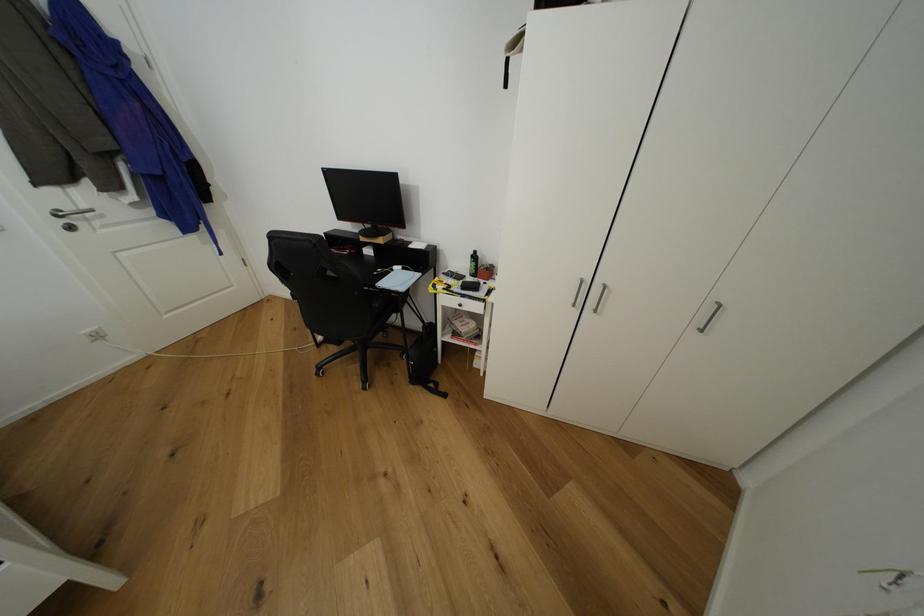
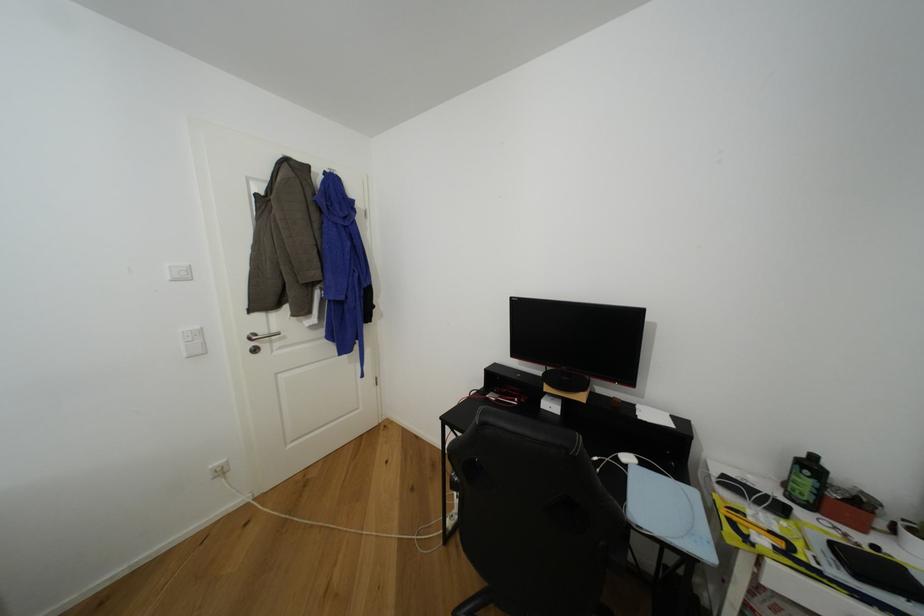
In the second image, find the point that corresponds to (x=480, y=254) in the first image.

(820, 459)